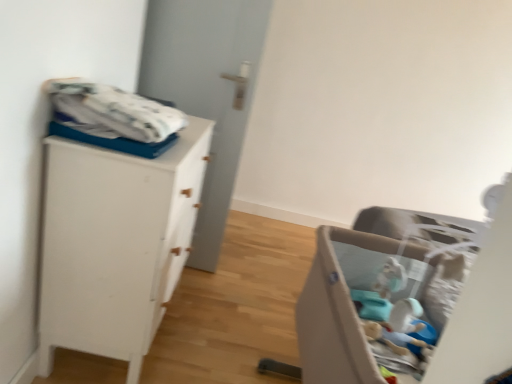
Image resolution: width=512 pixels, height=384 pixels. I want to click on white matte door at center, so click(x=207, y=90).

Find the location of a particular element. The width and height of the screenshot is (512, 384). white matte door at center is located at coordinates (207, 90).

Considering the positions of point (245, 19) and point (407, 369), is point (245, 19) closer or farther from the camera than point (407, 369)?

Point (245, 19) is farther from the camera than point (407, 369).

Is white matte door at center facing away from beige fabric playpen at lower right?

white matte door at center is not turned away from beige fabric playpen at lower right.

From a real-world perspective, which object rests below the other?

In real-world perspective, beige fabric playpen at lower right is lower.

In the scene shown: Who is taller, white matte door at center or beige fabric playpen at lower right?

white matte door at center is taller.

Is beige fabric playpen at lower right shorter than white cotton blanket at upper left?

Incorrect, the height of beige fabric playpen at lower right does not fall short of that of white cotton blanket at upper left.

Is beige fabric playpen at lower right in front of or behind white cotton blanket at upper left in the image?

Visually, beige fabric playpen at lower right is located in front of white cotton blanket at upper left.

From the image's perspective, is beige fabric playpen at lower right above or below white cotton blanket at upper left?

Based on their image positions, beige fabric playpen at lower right is located beneath white cotton blanket at upper left.

Does point (330, 233) lie in front of point (135, 126)?

No.

From a real-world perspective, is white cotton blanket at upper left located higher than white matte door at center?

Yes, from a real-world perspective, white cotton blanket at upper left is on top of white matte door at center.

Which object is closer to the camera, white cotton blanket at upper left or white matte door at center?

white cotton blanket at upper left is in front.

Considering the relative sizes of white cotton blanket at upper left and white matte door at center in the image provided, is white cotton blanket at upper left thinner than white matte door at center?

No.

Is white cotton blanket at upper left a part of white matte cabinet at left?

No, white cotton blanket at upper left is located outside of white matte cabinet at left.

Between point (102, 240) and point (55, 92), which one is positioned in front?

The point (55, 92) is closer to the camera.

This screenshot has width=512, height=384. In order to click on baby clothe that appears above the white matte cabinet at left (from the image's perspective) in this screenshot , I will do `click(112, 111)`.

Looking at this image, from the image's perspective, is white matte cabinet at left located above or below white cotton blanket at upper left?

From the image's perspective, white matte cabinet at left appears below white cotton blanket at upper left.

Does white matte cabinet at left have a smaller size compared to beige fabric playpen at lower right?

Yes.

Is the surface of white matte cabinet at left in direct contact with beige fabric playpen at lower right?

No.

Is white matte cabinet at left thinner than beige fabric playpen at lower right?

Correct, the width of white matte cabinet at left is less than that of beige fabric playpen at lower right.

Is point (221, 152) closer or farther from the camera than point (74, 148)?

Point (221, 152) is farther from the camera than point (74, 148).

Between white matte door at center and white matte cabinet at left, which one appears on the right side from the viewer's perspective?

Positioned to the right is white matte door at center.

Can you confirm if white matte door at center is thinner than white matte cabinet at left?

Yes.

Is white cotton blanket at upper left taller or shorter than beige fabric playpen at lower right?

white cotton blanket at upper left is shorter than beige fabric playpen at lower right.

Consider the image. Can you confirm if white cotton blanket at upper left is wider than beige fabric playpen at lower right?

No, white cotton blanket at upper left is not wider than beige fabric playpen at lower right.

Looking at this image, from the image's perspective, which object appears higher, white cotton blanket at upper left or beige fabric playpen at lower right?

white cotton blanket at upper left, from the image's perspective.

Measure the distance between white cotton blanket at upper left and beige fabric playpen at lower right.

white cotton blanket at upper left and beige fabric playpen at lower right are 80.08 centimeters apart.

Find the location of `door above the beige fabric playpen at lower right (from the image's perspective)`. door above the beige fabric playpen at lower right (from the image's perspective) is located at coordinates (207, 90).

You are a GUI agent. You are given a task and a screenshot of the screen. Output one action in this format:
    pyautogui.click(x=<x>, y=<y>)
    Task: Click on the furniture located on the right of white cotton blanket at upper left
    
    Given the screenshot: What is the action you would take?
    pyautogui.click(x=410, y=294)

When comparing their distances from beige fabric playpen at lower right, does white cotton blanket at upper left or white matte cabinet at left seem closer?

white matte cabinet at left is positioned closer to the anchor beige fabric playpen at lower right.

Which object lies nearer to the anchor point white matte cabinet at left, white matte door at center or beige fabric playpen at lower right?

beige fabric playpen at lower right lies closer to white matte cabinet at left than the other object.

Which object lies nearer to the anchor point beige fabric playpen at lower right, white matte door at center or white matte cabinet at left?

The object closer to beige fabric playpen at lower right is white matte cabinet at left.

Looking at the image, which one is located further to beige fabric playpen at lower right, white cotton blanket at upper left or white matte door at center?

white matte door at center lies further to beige fabric playpen at lower right than the other object.

Based on their spatial positions, is white matte door at center or white cotton blanket at upper left further from white matte cabinet at left?

Based on the image, white matte door at center appears to be further to white matte cabinet at left.

Looking at the image, which one is located closer to white matte door at center, white cotton blanket at upper left or beige fabric playpen at lower right?

Among the two, white cotton blanket at upper left is located nearer to white matte door at center.

Which object lies further to the anchor point white matte door at center, white matte cabinet at left or beige fabric playpen at lower right?

Among the two, beige fabric playpen at lower right is located further to white matte door at center.

From the image, which object appears to be nearer to beige fabric playpen at lower right, white matte cabinet at left or white matte door at center?

The object closer to beige fabric playpen at lower right is white matte cabinet at left.

This screenshot has height=384, width=512. I want to click on baby clothe between beige fabric playpen at lower right and white matte door at center along the z-axis, so click(112, 111).

The image size is (512, 384). What are the coordinates of `baby clothe between white matte cabinet at left and beige fabric playpen at lower right in the horizontal direction` in the screenshot? It's located at point(112,111).

Locate an element on the screen. chest of drawers between beige fabric playpen at lower right and white matte door at center from front to back is located at coordinates (115, 244).

This screenshot has width=512, height=384. What are the coordinates of `the chest of drawers positioned between white cotton blanket at upper left and white matte door at center from near to far` in the screenshot? It's located at (115, 244).